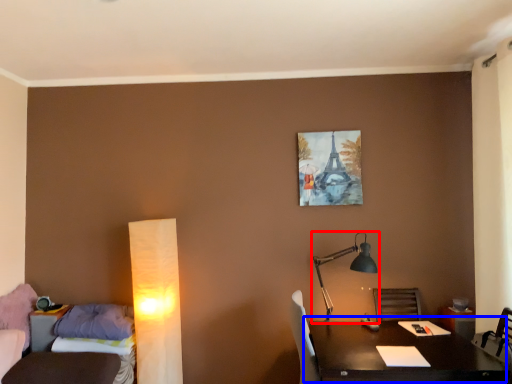
Question: Which point is closer to the camera, lamp (highlighted by a red box) or table (highlighted by a blue box)?

Choices:
 (A) lamp
 (B) table

Answer: (B)